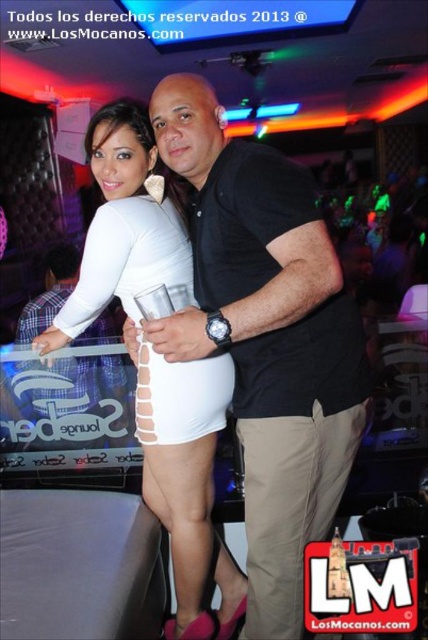
Is point (290, 552) in front of point (330, 512)?

Yes, it is in front of point (330, 512).

Locate an element on the screen. The width and height of the screenshot is (428, 640). black matte shirt at center is located at coordinates (267, 339).

Does point (163, 252) come closer to viewer compared to point (246, 460)?

No, (163, 252) is behind (246, 460).

Is white matte dress at center below tan cotton pants at center?

Actually, white matte dress at center is above tan cotton pants at center.

Is point (214, 356) more distant than point (267, 614)?

Yes.

Find the location of a particular element. white matte dress at center is located at coordinates (128, 260).

Is the position of white matte skirt at center more distant than that of white matte dress at center?

Yes, it is behind white matte dress at center.

Is white matte skirt at center bigger than white matte dress at center?

Indeed, white matte skirt at center has a larger size compared to white matte dress at center.

Which is behind, point (240, 582) or point (140, 282)?

The point (240, 582) is more distant.

Where is `white matte skirt at center`? white matte skirt at center is located at coordinates (122, 225).